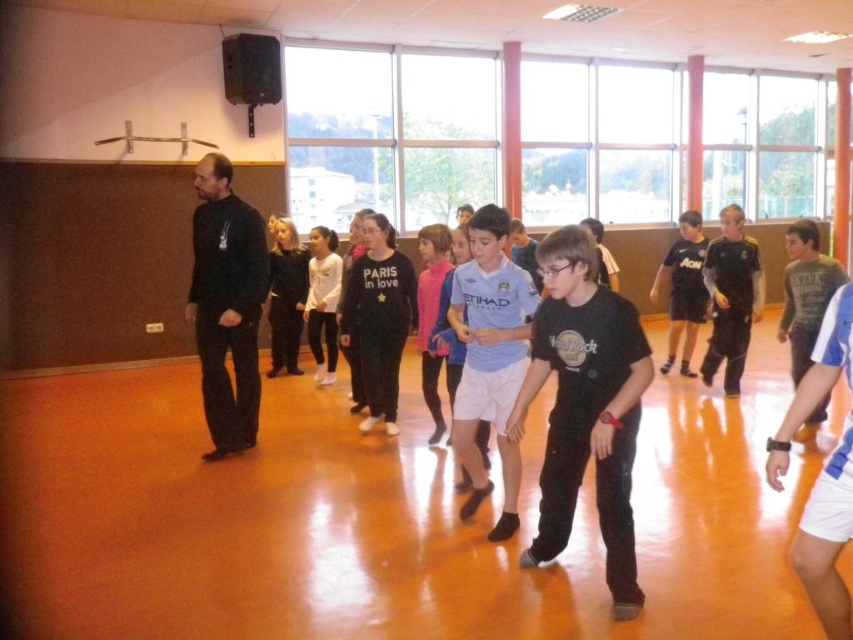
Question: Which object appears farthest from the camera in this image?

Choices:
 (A) black matte shorts at right
 (B) gray cotton shirt at center
 (C) pink fabric shirt at center
 (D) black matte shirt at center

Answer: (A)

Question: Which point is closer to the camera taking this photo?

Choices:
 (A) (677, 276)
 (B) (474, 480)

Answer: (B)

Question: Can you confirm if black matte shirt at center is thinner than gray cotton shirt at center?

Choices:
 (A) yes
 (B) no

Answer: (B)

Question: Does gray cotton shirt at center have a lesser width compared to black matte shorts at center?

Choices:
 (A) yes
 (B) no

Answer: (A)

Question: Does black matte shirt at center appear under black matte shorts at right?

Choices:
 (A) no
 (B) yes

Answer: (B)

Question: Which point is closer to the camera?

Choices:
 (A) (677, 262)
 (B) (421, 234)
 (C) (720, 259)

Answer: (B)